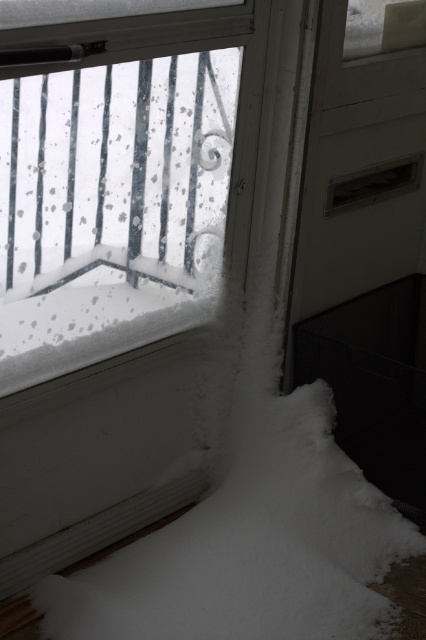
Which is more to the left, white matte screen door at lower right or white fluffy snow at lower left?

Positioned to the left is white fluffy snow at lower left.

At what (x,y) coordinates should I click in order to perform the action: click on white matte screen door at lower right. Please return your answer as a coordinate pair (x, y). The width and height of the screenshot is (426, 640). Looking at the image, I should click on (365, 240).